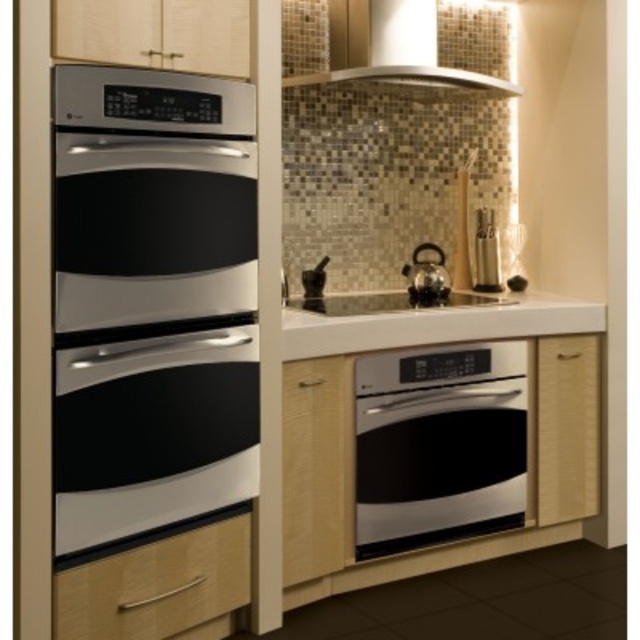
Question: Does satin stainless steel oven at center come behind white glossy exhaust hood at upper center?

Choices:
 (A) yes
 (B) no

Answer: (B)

Question: Which point is closer to the camera?

Choices:
 (A) stainless steel oven at left
 (B) matte black oven at left
 (C) black glass stove at center
 (D) white glossy exhaust hood at upper center

Answer: (A)

Question: Can you confirm if satin stainless steel oven at center is positioned below wooden drawer at lower left?

Choices:
 (A) yes
 (B) no

Answer: (B)

Question: Which point is closer to the camera?

Choices:
 (A) polished stainless steel kettle at center
 (B) white glossy countertop at center
 (C) satin stainless steel oven at center
 (D) black glass stove at center

Answer: (B)

Question: Which point appears farthest from the camera in this image?

Choices:
 (A) (344, 28)
 (B) (211, 531)
 (C) (499, 476)
 (D) (100, 88)

Answer: (A)

Question: Is the position of white glossy countertop at center less distant than that of black glass stove at center?

Choices:
 (A) no
 (B) yes

Answer: (B)